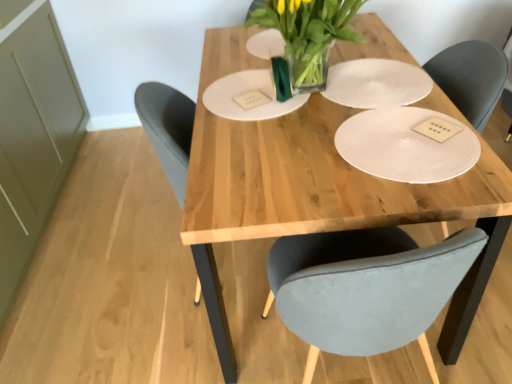
Locate an element on the screen. The image size is (512, 384). vacant space in between white matte paper plate at center, which is counted as the 1th paper plate, starting from the left, and white textured plate at center is located at coordinates (319, 122).